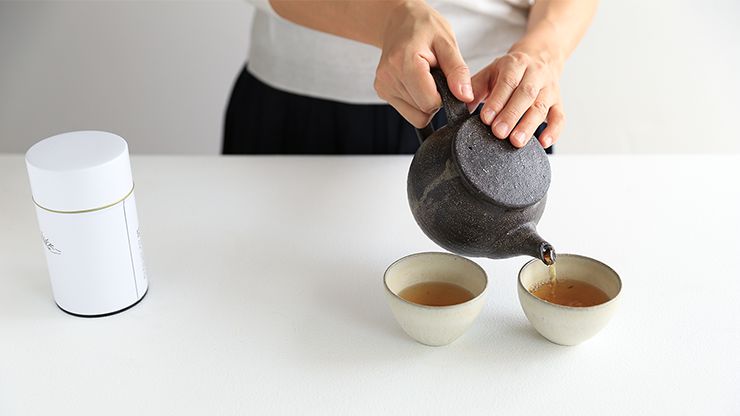
You are a GUI agent. You are given a task and a screenshot of the screen. Output one action in this format:
    pyautogui.click(x=<x>, y=<y>)
    Task: Click on the charcoal gray teapot
    
    Given the screenshot: What is the action you would take?
    pyautogui.click(x=434, y=148), pyautogui.click(x=468, y=210)